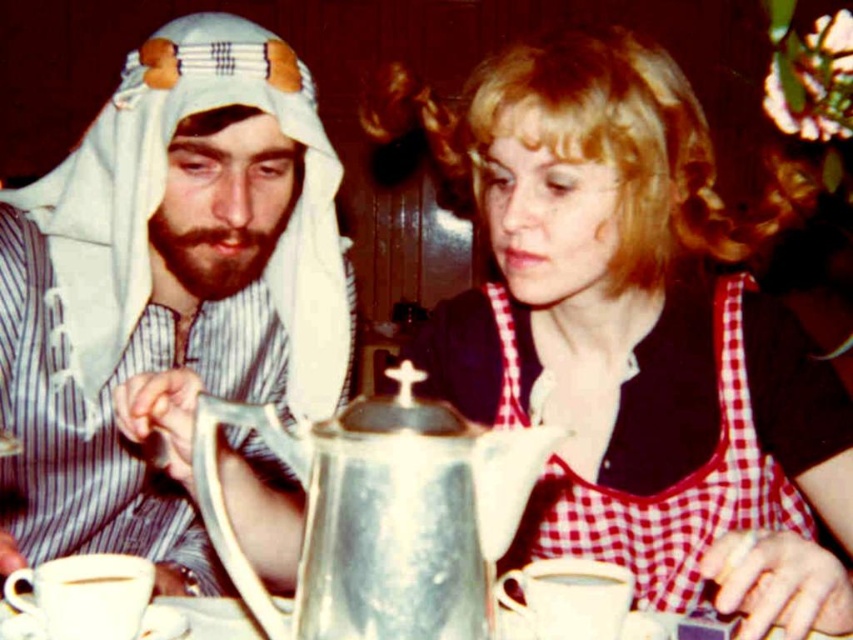
Consider the image. You are a customer at a cafe and want to pour yourself a cup of tea. The silver metallic teapot at center and the metallic silver coffee pot at center are both on the table. Which one should you use to get tea?

You should use the silver metallic teapot at center because it is the one holding the tea, while the metallic silver coffee pot at center contains coffee.

You are a customer at a cafe and you want to pour tea from the silver metallic teapot at center into your cup. The server is holding the metallic silver coffee pot at center. Where should you reach to get the tea?

The silver metallic teapot at center is in front of the metallic silver coffee pot at center, so you should reach in front of the coffee pot to get the teapot.

You are a customer at a restaurant and want to pour tea from the matte white teapot at center. Where should you reach to grab it?

The matte white teapot at center is located at point 0.517 on the x and 0.743 on the y coordinates, so you should reach towards those coordinates to grab it.